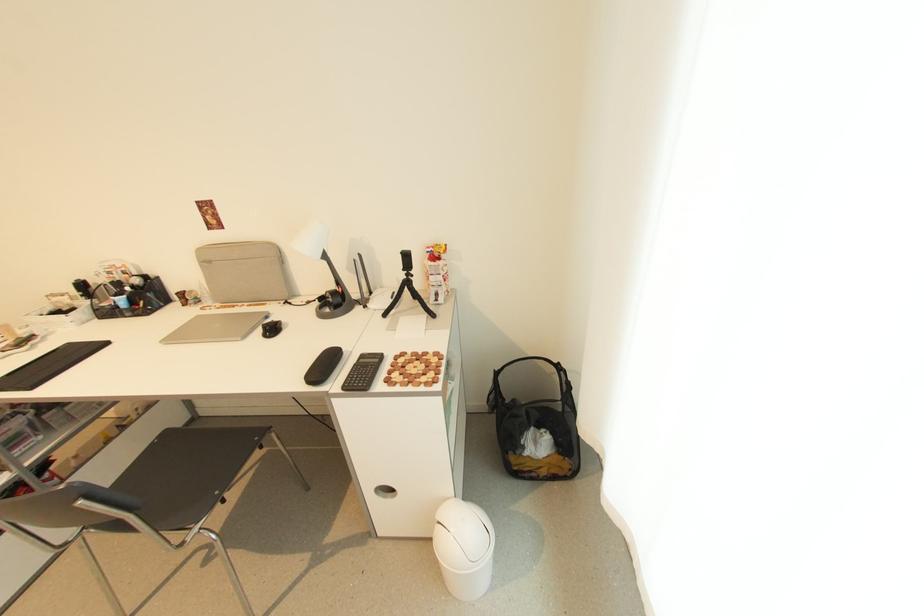
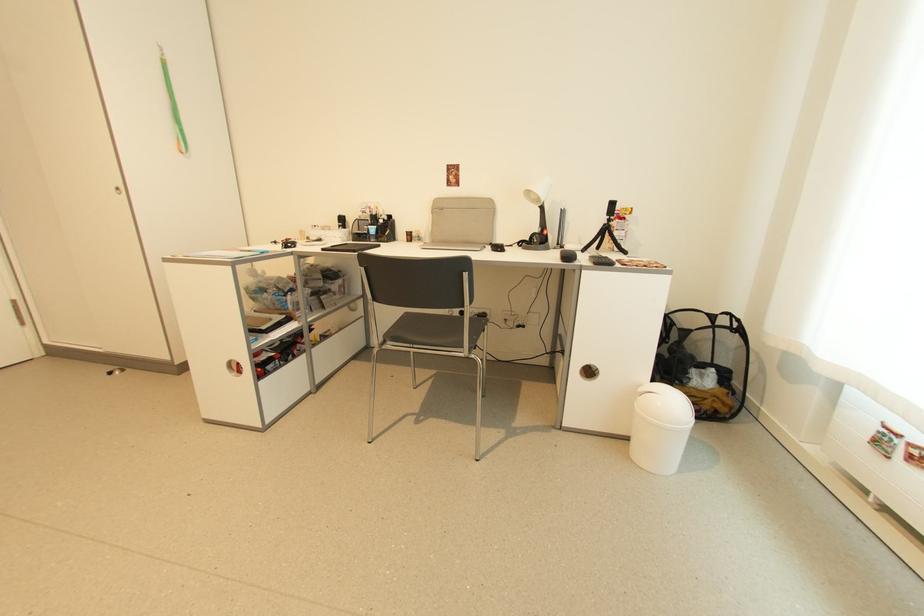
In the second image, find the point that corresponds to pixel 531 455 in the first image.

(697, 386)